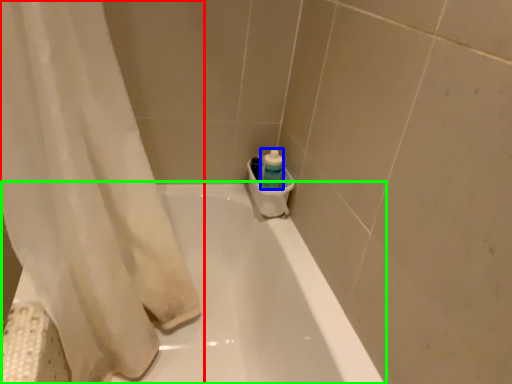
Question: Which object is positioned farthest from curtain (highlighted by a red box)? Select from cleaning product (highlighted by a blue box) and bathtub (highlighted by a green box).

Choices:
 (A) cleaning product
 (B) bathtub

Answer: (A)